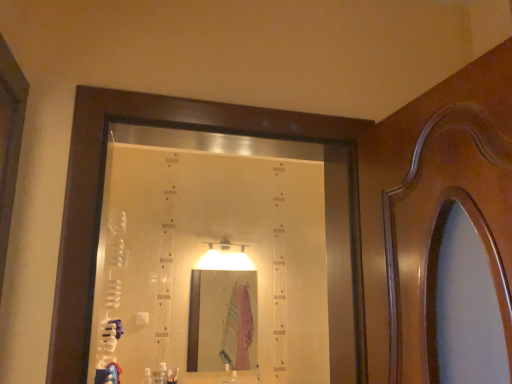
Question: Which direction should I rotate to face clear plastic bottle at lower center, the 1th toiletry when ordered from right to left, — up or down?

Choices:
 (A) up
 (B) down

Answer: (B)

Question: Is blue cotton robe at lower left located within white plastic bottle at lower center, which is the second toiletry from right to left?

Choices:
 (A) no
 (B) yes

Answer: (A)

Question: Are white plastic bottle at lower center, which is the second toiletry from right to left, and blue cotton robe at lower left far apart?

Choices:
 (A) yes
 (B) no

Answer: (B)

Question: From a real-world perspective, does white plastic bottle at lower center, which is the second toiletry from right to left, sit lower than blue cotton robe at lower left?

Choices:
 (A) no
 (B) yes

Answer: (B)

Question: Does white plastic bottle at lower center, positioned as the first toiletry in left-to-right order, appear on the left side of blue cotton robe at lower left?

Choices:
 (A) no
 (B) yes

Answer: (A)

Question: Does white plastic bottle at lower center, which is the second toiletry from right to left, have a lesser width compared to blue cotton robe at lower left?

Choices:
 (A) no
 (B) yes

Answer: (B)

Question: Is white plastic bottle at lower center, which is the second toiletry from right to left, facing away from blue cotton robe at lower left?

Choices:
 (A) yes
 (B) no

Answer: (B)

Question: Is pink fabric at center turned away from white plastic bottle at lower center, positioned as the first toiletry in left-to-right order?

Choices:
 (A) yes
 (B) no

Answer: (B)

Question: Is pink fabric at center thinner than white plastic bottle at lower center, positioned as the first toiletry in left-to-right order?

Choices:
 (A) yes
 (B) no

Answer: (A)

Question: From the image's perspective, does pink fabric at center appear higher than white plastic bottle at lower center, which is the second toiletry from right to left?

Choices:
 (A) yes
 (B) no

Answer: (A)

Question: Can you confirm if pink fabric at center is shorter than white plastic bottle at lower center, positioned as the first toiletry in left-to-right order?

Choices:
 (A) yes
 (B) no

Answer: (B)

Question: Is pink fabric at center completely or partially outside of white plastic bottle at lower center, which is the second toiletry from right to left?

Choices:
 (A) yes
 (B) no

Answer: (A)

Question: From the image's perspective, is pink fabric at center below white plastic bottle at lower center, positioned as the first toiletry in left-to-right order?

Choices:
 (A) yes
 (B) no

Answer: (B)

Question: From the image's perspective, is white plastic bottle at lower center, which is the second toiletry from right to left, located above pink fabric at center?

Choices:
 (A) yes
 (B) no

Answer: (B)